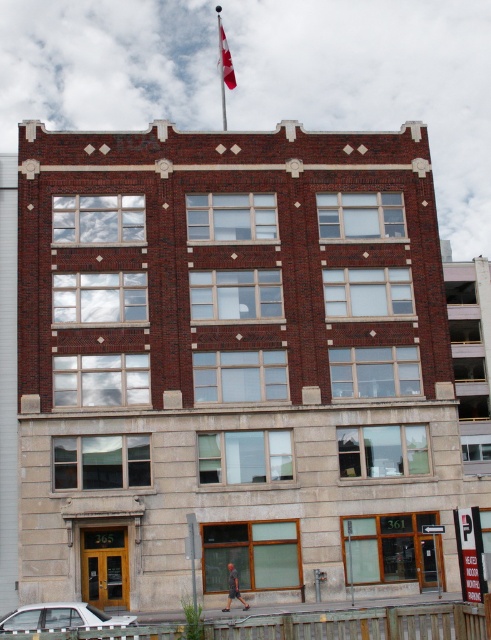
Between point (35, 616) and point (218, 28), which one is positioned behind?

The point (218, 28) is behind.

Between white matte sedan at lower left and metallic flag pole at upper center, which one is positioned higher?

metallic flag pole at upper center is above.

Is point (41, 618) less distant than point (221, 76)?

That is True.

Image resolution: width=491 pixels, height=640 pixels. I want to click on white matte sedan at lower left, so click(60, 618).

Does point (221, 67) come behind point (228, 70)?

Yes, point (221, 67) is behind point (228, 70).

Can you confirm if metallic flag pole at upper center is smaller than red fabric flag at upper center?

No, metallic flag pole at upper center is not smaller than red fabric flag at upper center.

The height and width of the screenshot is (640, 491). What do you see at coordinates (223, 65) in the screenshot?
I see `metallic flag pole at upper center` at bounding box center [223, 65].

I want to click on metallic flag pole at upper center, so click(x=223, y=65).

Between point (18, 612) and point (223, 61), which one is positioned behind?

Point (223, 61)

Is point (54, 628) in front of point (221, 33)?

Yes.

The height and width of the screenshot is (640, 491). Identify the location of white matte sedan at lower left. (60, 618).

You are a GUI agent. You are given a task and a screenshot of the screen. Output one action in this format:
    pyautogui.click(x=<x>, y=<y>)
    Task: Click on the white matte sedan at lower left
    
    Given the screenshot: What is the action you would take?
    pyautogui.click(x=60, y=618)